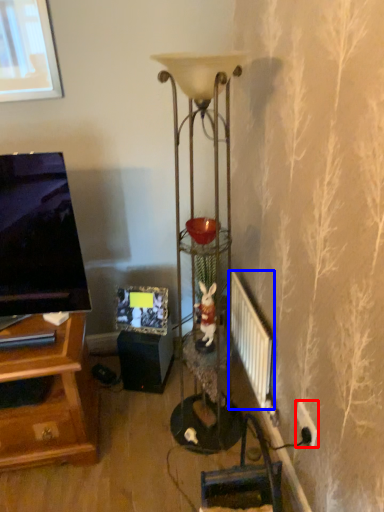
Question: Which object appears farthest to the camera in this image, electric outlet (highlighted by a red box) or radiator (highlighted by a blue box)?

Choices:
 (A) electric outlet
 (B) radiator

Answer: (B)